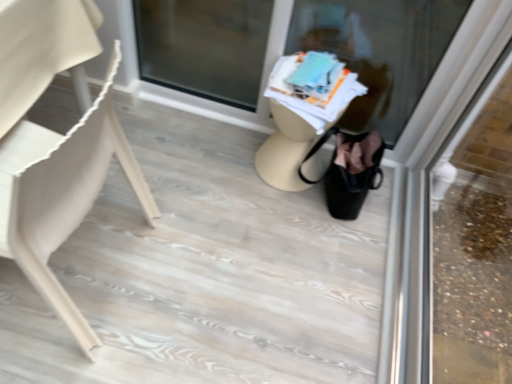
Describe the element at coordinates (475, 241) in the screenshot. I see `transparent glass door at upper right, the 2th shop window from the left` at that location.

Identify the location of transparent glass door at upper right, the 2th shop window from the left. This screenshot has height=384, width=512. (475, 241).

Does translucent glass at center, the first shop window viewed from the left, appear on the right side of transparent glass door at upper right, the 2th shop window from the left?

No.

Does translucent glass at center, the 2th shop window in the right-to-left sequence, have a smaller size compared to transparent glass door at upper right, marked as the first shop window in a right-to-left arrangement?

No, translucent glass at center, the 2th shop window in the right-to-left sequence, is not smaller than transparent glass door at upper right, marked as the first shop window in a right-to-left arrangement.

Is translucent glass at center, the 2th shop window in the right-to-left sequence, next to transparent glass door at upper right, the 2th shop window from the left?

No, translucent glass at center, the 2th shop window in the right-to-left sequence, is not with transparent glass door at upper right, the 2th shop window from the left.

Which of these two, translucent glass at center, the first shop window viewed from the left, or transparent glass door at upper right, marked as the first shop window in a right-to-left arrangement, is thinner?

With smaller width is transparent glass door at upper right, marked as the first shop window in a right-to-left arrangement.

Is beige matte table at center wider than matte beige chair at left?

In fact, beige matte table at center might be narrower than matte beige chair at left.

Between point (293, 132) and point (39, 260), which one is positioned behind?

Positioned behind is point (293, 132).

What's the angular difference between beige matte table at center and matte beige chair at left's facing directions?

88.9 degrees.

From the picture: Is beige matte table at center oriented away from matte beige chair at left?

beige matte table at center is not turned away from matte beige chair at left.

In the scene shown: Is transparent glass door at upper right, the 2th shop window from the left, in front of or behind beige matte table at center in the image?

In the image, transparent glass door at upper right, the 2th shop window from the left, appears in front of beige matte table at center.

Is point (489, 353) closer or farther from the camera than point (303, 139)?

Point (489, 353) is positioned closer to the camera compared to point (303, 139).

Between transparent glass door at upper right, the 2th shop window from the left, and beige matte table at center, which one has less height?

Standing shorter between the two is beige matte table at center.

From a real-world perspective, starting from the beige matte table at center, which shop window is the 2nd one vertically above it? Please provide its 2D coordinates.

[(475, 241)]

Considering the relative sizes of matte beige chair at left and transparent glass door at upper right, marked as the first shop window in a right-to-left arrangement, in the image provided, is matte beige chair at left bigger than transparent glass door at upper right, marked as the first shop window in a right-to-left arrangement,?

Indeed, matte beige chair at left has a larger size compared to transparent glass door at upper right, marked as the first shop window in a right-to-left arrangement.

How much distance is there between matte beige chair at left and transparent glass door at upper right, marked as the first shop window in a right-to-left arrangement?

matte beige chair at left is 1.35 meters from transparent glass door at upper right, marked as the first shop window in a right-to-left arrangement.

Locate an element on the screen. This screenshot has height=384, width=512. shop window that is the 2nd one when counting rightward from the matte beige chair at left is located at coordinates (475, 241).

Which is more to the right, matte beige chair at left or transparent glass door at upper right, the 2th shop window from the left?

transparent glass door at upper right, the 2th shop window from the left, is more to the right.

Is point (302, 135) positioned behind point (503, 192)?

No, (302, 135) is in front of (503, 192).

From the image's perspective, is beige matte table at center located beneath transparent glass door at upper right, the 2th shop window from the left?

No, from the image's perspective, beige matte table at center is not below transparent glass door at upper right, the 2th shop window from the left.

Which is behind, beige matte table at center or transparent glass door at upper right, marked as the first shop window in a right-to-left arrangement?

beige matte table at center is further from the camera.

What are the coordinates of `table above the transparent glass door at upper right, the 2th shop window from the left (from the image's perspective)` in the screenshot? It's located at (285, 150).

Find the location of a particular element. the 1st shop window in front when counting from the beige matte table at center is located at coordinates (379, 51).

From a real-world perspective, is translucent glass at center, the 2th shop window in the right-to-left sequence, physically below beige matte table at center?

No, from a real-world perspective, translucent glass at center, the 2th shop window in the right-to-left sequence, is not beneath beige matte table at center.

Can you confirm if translucent glass at center, the first shop window viewed from the left, is shorter than beige matte table at center?

No.

Is the depth of beige matte table at center greater than that of translucent glass at center, the 2th shop window in the right-to-left sequence?

Yes, beige matte table at center is further from the camera.

Between point (294, 160) and point (251, 2), which one is positioned in front?

Positioned in front is point (294, 160).

Considering the sizes of objects beige matte table at center and translucent glass at center, the first shop window viewed from the left, in the image provided, who is shorter, beige matte table at center or translucent glass at center, the first shop window viewed from the left,?

beige matte table at center.

The height and width of the screenshot is (384, 512). In order to click on shop window that is behind the transparent glass door at upper right, marked as the first shop window in a right-to-left arrangement in this screenshot , I will do pyautogui.click(x=379, y=51).

Image resolution: width=512 pixels, height=384 pixels. In order to click on table above the matte beige chair at left (from the image's perspective) in this screenshot , I will do `click(285, 150)`.

Which object lies further to the anchor point matte beige chair at left, transparent glass door at upper right, the 2th shop window from the left, or translucent glass at center, the 2th shop window in the right-to-left sequence?

Among the two, transparent glass door at upper right, the 2th shop window from the left, is located further to matte beige chair at left.

When comparing their distances from translucent glass at center, the first shop window viewed from the left, does beige matte table at center or matte beige chair at left seem closer?

Based on the image, beige matte table at center appears to be nearer to translucent glass at center, the first shop window viewed from the left.

Based on their spatial positions, is transparent glass door at upper right, marked as the first shop window in a right-to-left arrangement, or beige matte table at center closer to matte beige chair at left?

The object closer to matte beige chair at left is beige matte table at center.

From the picture: Based on their spatial positions, is translucent glass at center, the 2th shop window in the right-to-left sequence, or beige matte table at center closer to transparent glass door at upper right, the 2th shop window from the left?

translucent glass at center, the 2th shop window in the right-to-left sequence, is positioned closer to the anchor transparent glass door at upper right, the 2th shop window from the left.

When comparing their distances from transparent glass door at upper right, marked as the first shop window in a right-to-left arrangement, does beige matte table at center or translucent glass at center, the first shop window viewed from the left, seem closer?

The object closer to transparent glass door at upper right, marked as the first shop window in a right-to-left arrangement, is translucent glass at center, the first shop window viewed from the left.

When comparing their distances from beige matte table at center, does matte beige chair at left or transparent glass door at upper right, marked as the first shop window in a right-to-left arrangement, seem further?

transparent glass door at upper right, marked as the first shop window in a right-to-left arrangement, lies further to beige matte table at center than the other object.

Based on their spatial positions, is matte beige chair at left or translucent glass at center, the first shop window viewed from the left, closer to transparent glass door at upper right, marked as the first shop window in a right-to-left arrangement?

translucent glass at center, the first shop window viewed from the left.

Based on their spatial positions, is matte beige chair at left or translucent glass at center, the 2th shop window in the right-to-left sequence, further from beige matte table at center?

matte beige chair at left.

You are a GUI agent. You are given a task and a screenshot of the screen. Output one action in this format:
    pyautogui.click(x=<x>, y=<y>)
    Task: Click on the table between matte beige chair at left and transparent glass door at upper right, the 2th shop window from the left, from left to right
    Image resolution: width=512 pixels, height=384 pixels.
    Given the screenshot: What is the action you would take?
    pyautogui.click(x=285, y=150)

Where is `shop window between matte beige chair at left and beige matte table at center in the horizontal direction`? The image size is (512, 384). shop window between matte beige chair at left and beige matte table at center in the horizontal direction is located at coordinates (379, 51).

Locate an element on the screen. This screenshot has width=512, height=384. shop window between matte beige chair at left and transparent glass door at upper right, the 2th shop window from the left, from left to right is located at coordinates (379, 51).

Locate an element on the screen. shop window between transparent glass door at upper right, the 2th shop window from the left, and beige matte table at center from front to back is located at coordinates (379, 51).